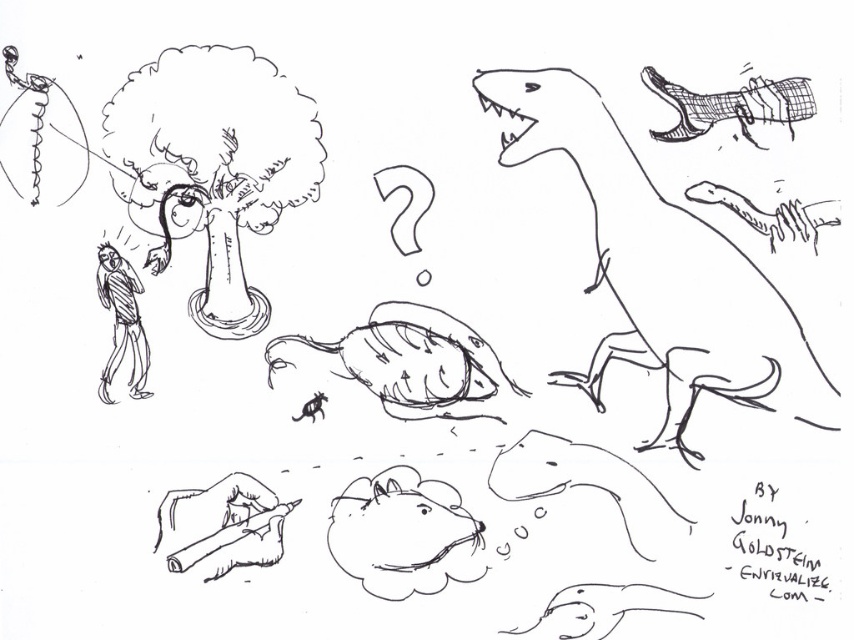
Between smooth gray dinosaur at lower center and smooth white snake at lower right, which one has less height?

smooth white snake at lower right

Where is `smooth gray dinosaur at lower center`? Image resolution: width=854 pixels, height=640 pixels. smooth gray dinosaur at lower center is located at coordinates (588, 484).

Between point (502, 472) and point (583, 586), which one is positioned behind?

Point (502, 472)

Locate an element on the screen. The image size is (854, 640). smooth gray dinosaur at lower center is located at coordinates (588, 484).

Is smooth wooden pencil at lower left in front of smooth white snake at lower right?

No.

Looking at this image, who is more forward, (237, 552) or (583, 582)?

Point (237, 552)

Locate an element on the screen. The height and width of the screenshot is (640, 854). smooth wooden pencil at lower left is located at coordinates (221, 525).

Which is below, fluffy white cloud at upper left or smooth brown mouse at center?

Positioned lower is smooth brown mouse at center.

Identify the location of fluffy white cloud at upper left. This screenshot has width=854, height=640. pos(214,164).